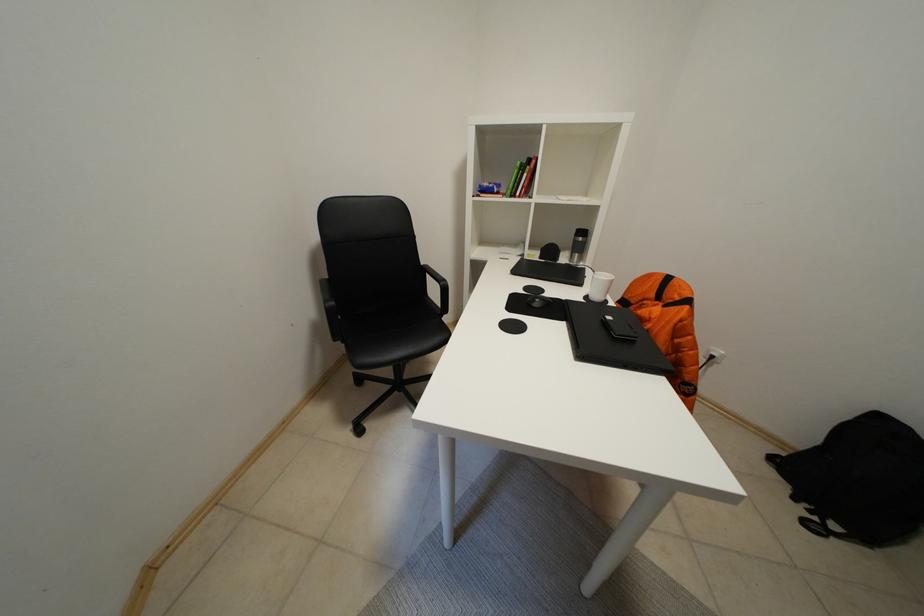
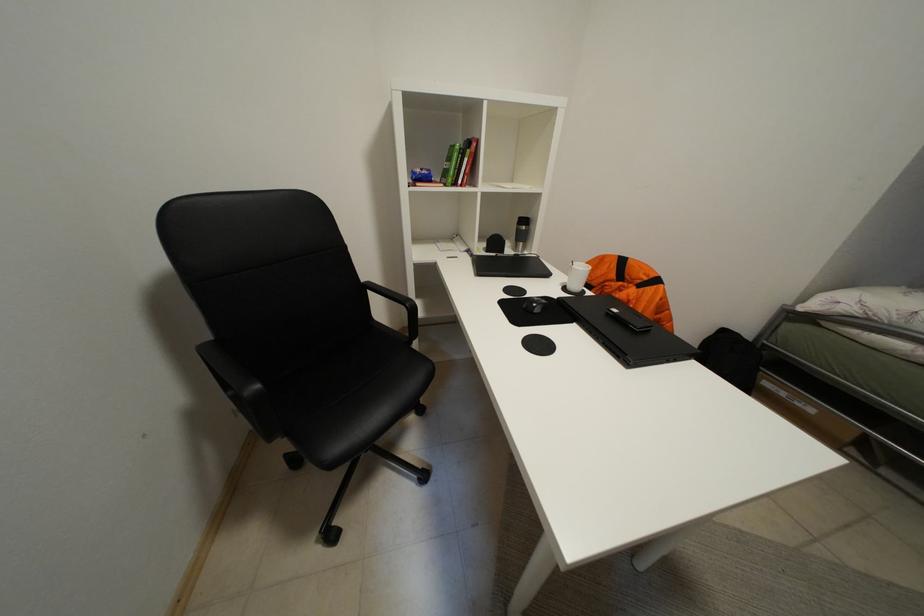
Question: The camera is either moving clockwise (left) or counter-clockwise (right) around the object. The first image is from the beginning of the video and the second image is from the end. Is the camera moving left or right when shooting the video?

Choices:
 (A) Left
 (B) Right

Answer: (A)